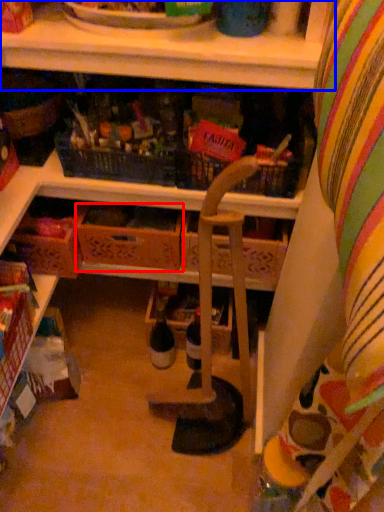
Question: Which of the following is the closest to the observer, drawer (highlighted by a red box) or shelf (highlighted by a blue box)?

Choices:
 (A) drawer
 (B) shelf

Answer: (B)